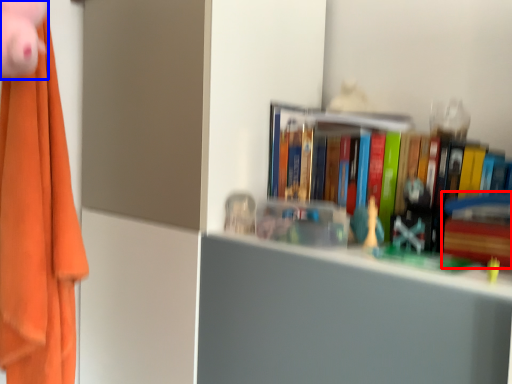
Question: Which object is further to the camera taking this photo, paperback book (highlighted by a red box) or toy (highlighted by a blue box)?

Choices:
 (A) paperback book
 (B) toy

Answer: (A)